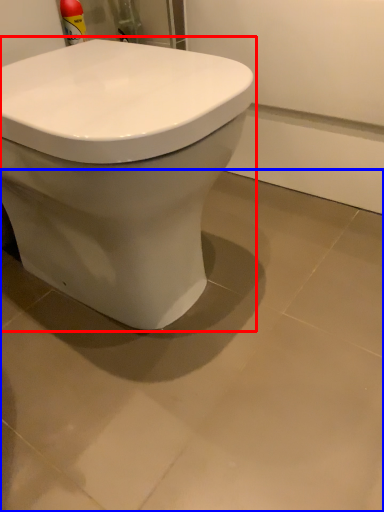
Question: Which object is closer to the camera taking this photo, toilet (highlighted by a red box) or ceramic tile (highlighted by a blue box)?

Choices:
 (A) toilet
 (B) ceramic tile

Answer: (A)